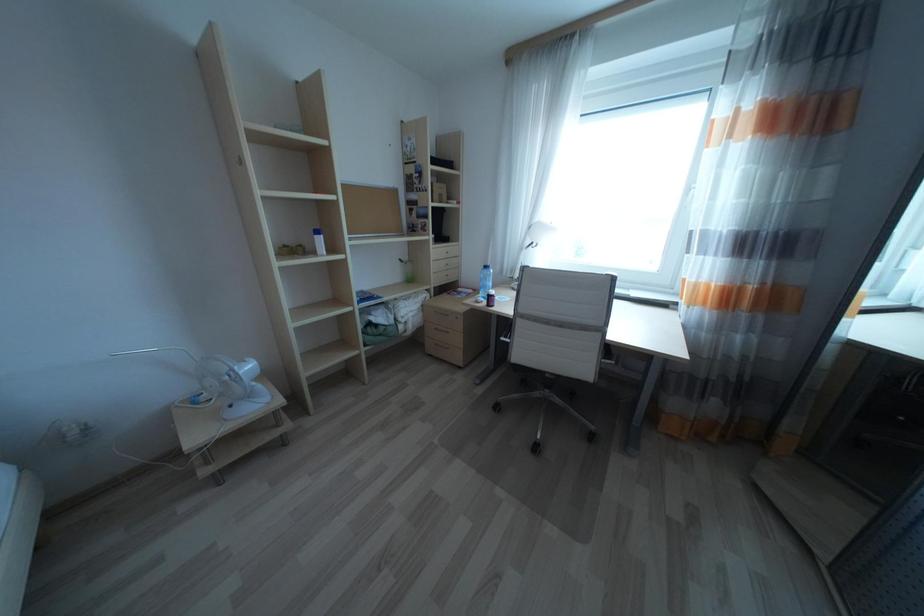
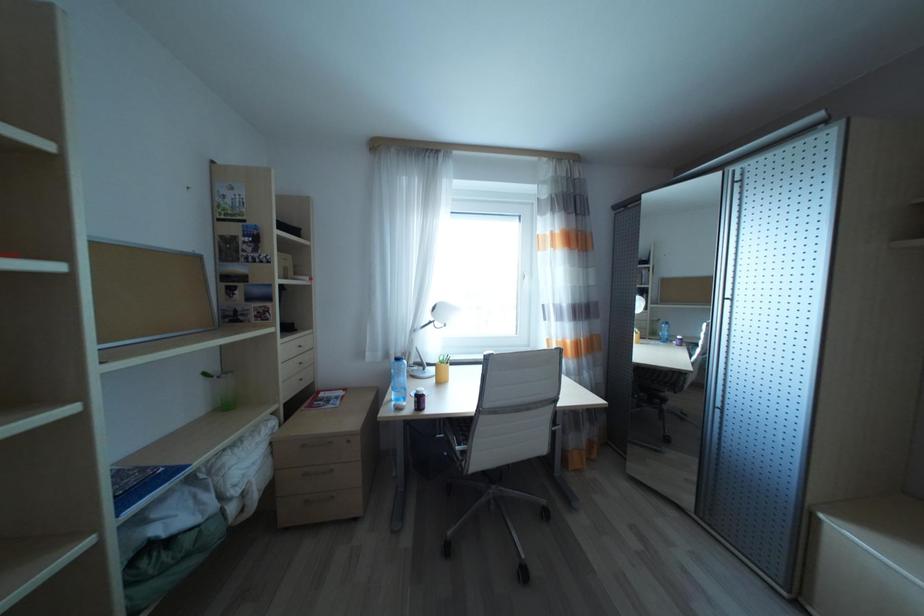
Question: Based on the continuous images, in which direction is the camera rotating? Reply with the corresponding letter.

Choices:
 (A) Left
 (B) Right
 (C) Up
 (D) Down

Answer: (B)